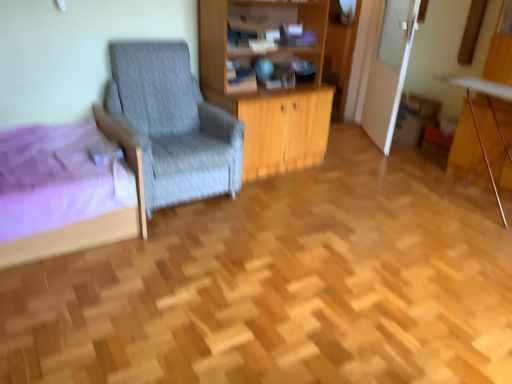
The image size is (512, 384). What are the coordinates of `vacant point to the right of wooden cabinet at center` in the screenshot? It's located at (353, 163).